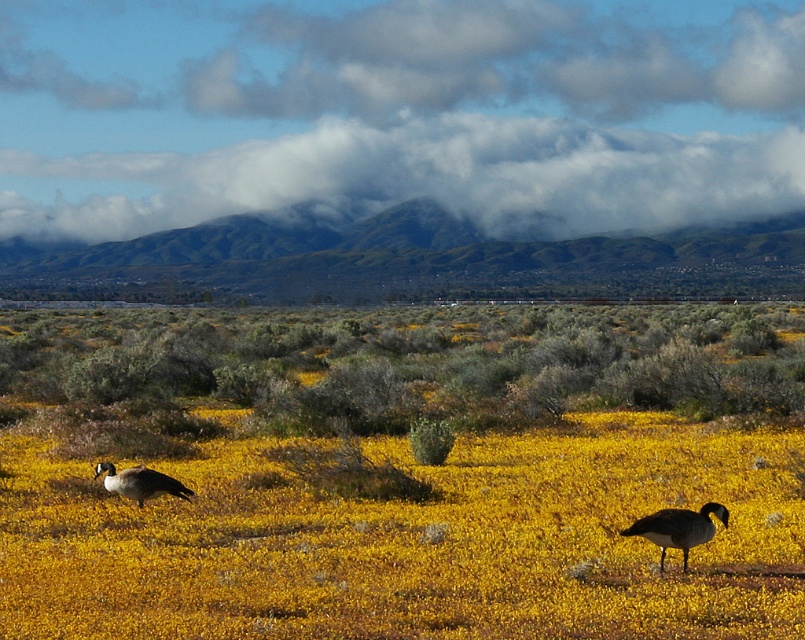
Question: Which object appears farthest from the camera in this image?

Choices:
 (A) yellow matte flower at lower left
 (B) dark gray matte goose at lower right
 (C) dark gray goose at lower left

Answer: (C)

Question: Does dark gray matte goose at lower right have a smaller size compared to dark gray goose at lower left?

Choices:
 (A) yes
 (B) no

Answer: (A)

Question: Which point appears closest to the camera in this image?

Choices:
 (A) (676, 538)
 (B) (122, 492)
 (C) (364, 448)

Answer: (A)

Question: Is dark gray matte goose at lower right closer to the viewer compared to dark gray goose at lower left?

Choices:
 (A) yes
 (B) no

Answer: (A)

Question: Among these objects, which one is nearest to the camera?

Choices:
 (A) dark gray goose at lower left
 (B) yellow matte flower at lower left
 (C) dark gray matte goose at lower right

Answer: (B)

Question: Is yellow matte flower at lower left further to camera compared to dark gray matte goose at lower right?

Choices:
 (A) no
 (B) yes

Answer: (A)